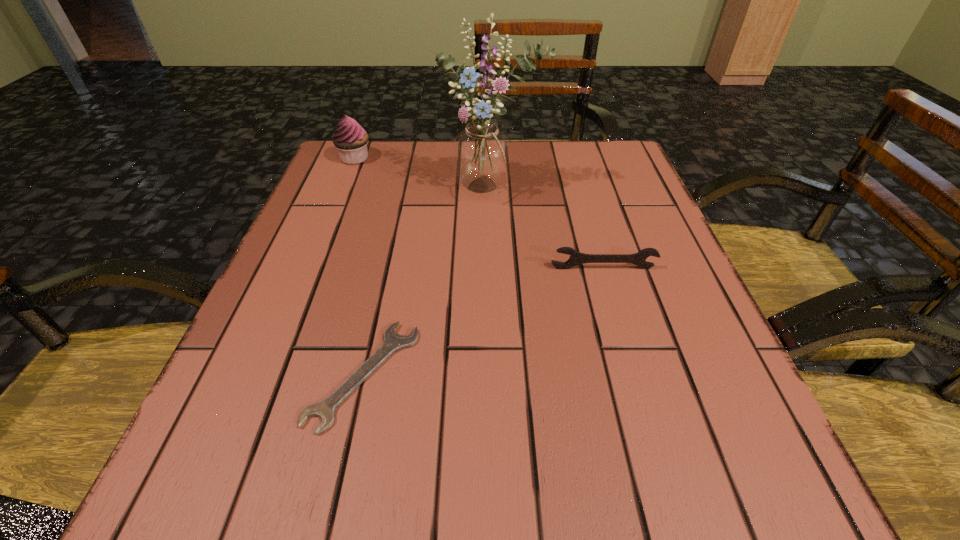
You are a GUI agent. You are given a task and a screenshot of the screen. Output one action in this format:
    pyautogui.click(x=<x>, y=<y>)
    Task: Click on the free space between the second farthest object and the shortest object
    This screenshot has height=540, width=960.
    Given the screenshot: What is the action you would take?
    (x=427, y=282)

Locate an element on the screen. Image resolution: width=960 pixels, height=540 pixels. vacant point located between the bouquet and the farthest object is located at coordinates (422, 174).

I want to click on empty location between the nearest object and the leftmost object, so click(x=359, y=266).

This screenshot has height=540, width=960. Identify the location of object that is the third closest to the third tallest object. (350, 139).

Locate an element on the screen. object that stands as the second closest to the taller wrench is located at coordinates (325, 409).